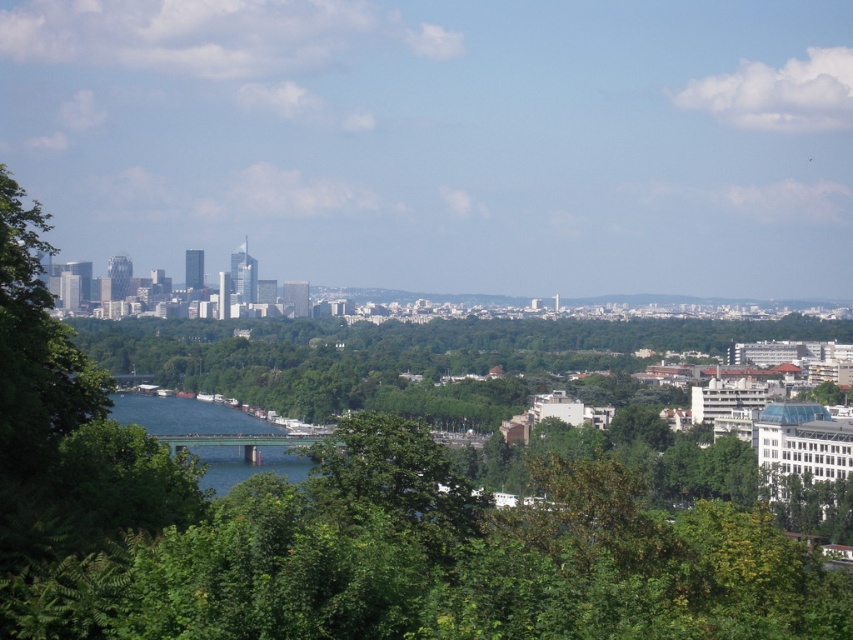
You are a drone operator trying to capture a photo of the city skyline. Your drone is currently hovering above the green leafy trees at center and the blue glassy water at center. To get a clear shot of the skyscrapers on the left, which direction should you move the drone relative to these two objects?

The green leafy trees at center is positioned on the right side of blue glassy water at center. To capture the skyscrapers on the left, you should move the drone to the left relative to the blue glassy water at center, which is on the right side of the green leafy trees at center.

You are standing at a vantage point overlooking the city. You notice two points marked in the image. Based on their positions, which point is closer to you, point (x=645, y=365) or point (x=234, y=416)?

Point (x=645, y=365) is further to the viewer than point (x=234, y=416), so the closer point to you is point (x=234, y=416).

You are a drone operator trying to fly a drone through the cityscape. You need to navigate between the green leafy trees at center and the blue glassy water at center. Which object should you avoid flying too close to if you want to maintain a safe distance based on their widths?

The green leafy trees at center might be wider than blue glassy water at center, so you should avoid flying too close to the green leafy trees at center to maintain a safe distance.